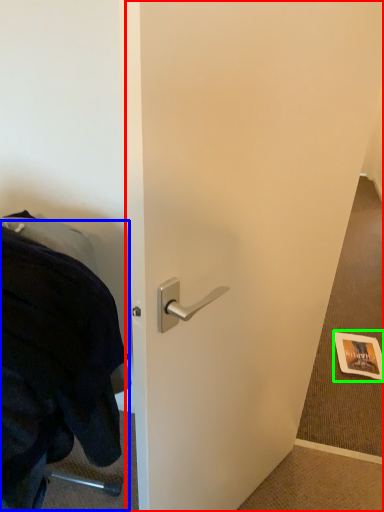
Question: Which object is the closest to the door (highlighted by a red box)? Choose among these: blanket (highlighted by a blue box) or postcard (highlighted by a green box).

Choices:
 (A) blanket
 (B) postcard

Answer: (A)